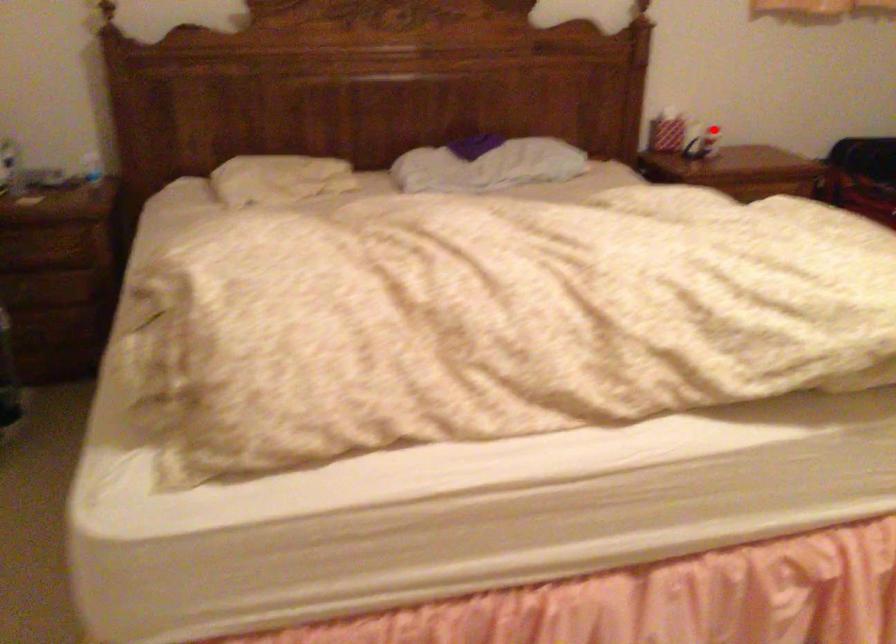
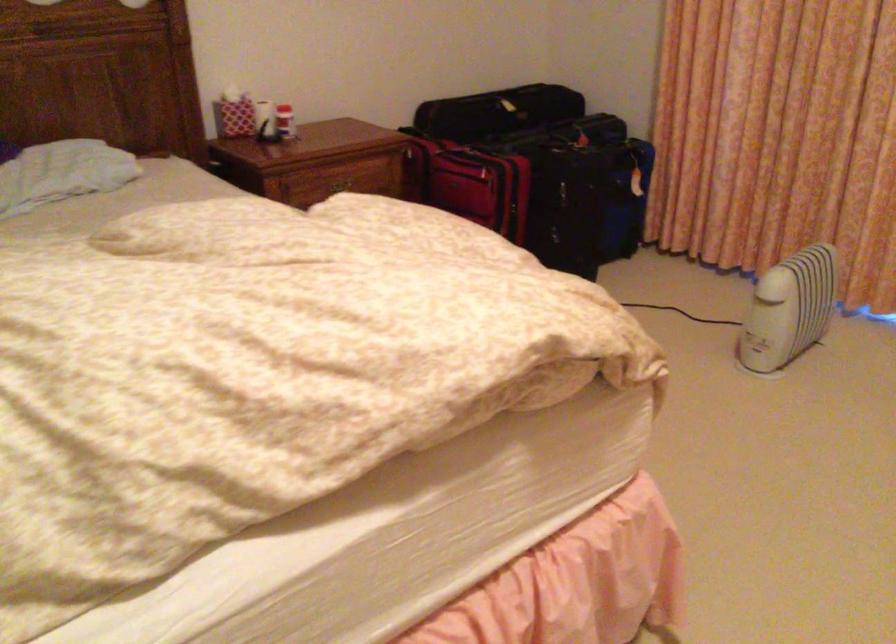
Question: A red point is marked in image1. In image2, is the corresponding 3D point closer to the camera or farther? Reply with the corresponding letter.

Choices:
 (A) The corresponding 3D point is closer.
 (B) The corresponding 3D point is farther.

Answer: (A)